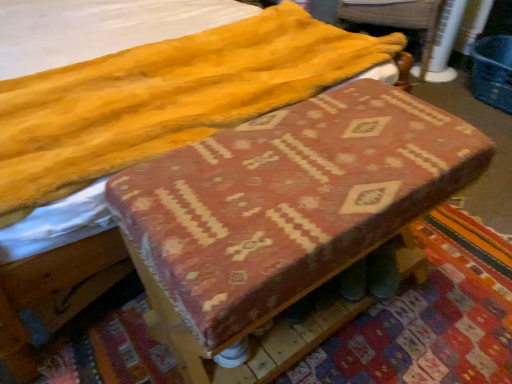
The height and width of the screenshot is (384, 512). In order to click on vacant region to the right of textured fabric changing table at center in this screenshot , I will do `click(449, 296)`.